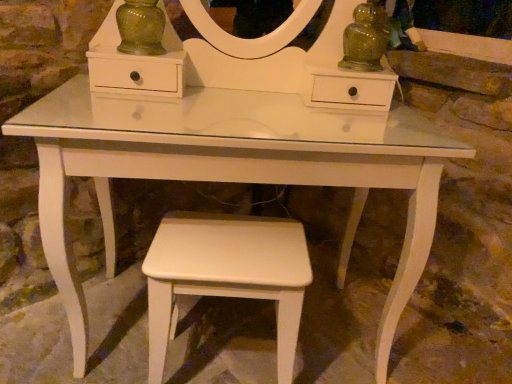
The height and width of the screenshot is (384, 512). I want to click on vacant area situated below white matte stool at lower center (from a real-world perspective), so (223, 364).